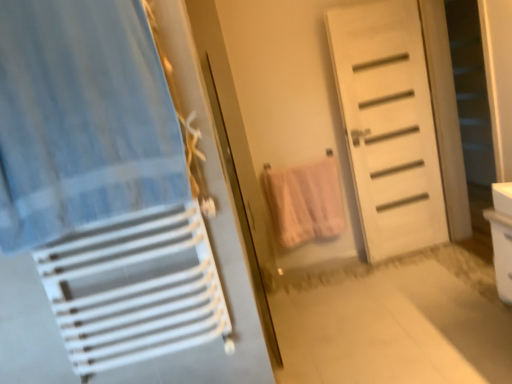
The height and width of the screenshot is (384, 512). What do you see at coordinates (388, 125) in the screenshot?
I see `white matte door at center` at bounding box center [388, 125].

This screenshot has width=512, height=384. Find the location of `blue striped fabric at left`. blue striped fabric at left is located at coordinates (82, 119).

The height and width of the screenshot is (384, 512). What are the coordinates of `pink cotton towel at center` in the screenshot? It's located at (305, 201).

Where is `white matte screen door at right`? This screenshot has height=384, width=512. white matte screen door at right is located at coordinates point(471,90).

I want to click on white plastic drawer at right, so click(x=501, y=251).

This screenshot has height=384, width=512. Identify the location of white matte door at center. (388, 125).

At what (x,y) coordinates should I click in order to perform the action: click on door to the right of blue striped fabric at left. Please return your answer as a coordinate pair (x, y). Looking at the image, I should click on (388, 125).

Based on their sizes in the image, would you say white matte door at center is bigger or smaller than blue striped fabric at left?

In the image, white matte door at center appears to be larger than blue striped fabric at left.

Is white matte door at center aimed at blue striped fabric at left?

No.

Based on the photo, is white matte door at center far away from blue striped fabric at left?

white matte door at center is far away from blue striped fabric at left.

From the image's perspective, is pink cotton towel at center positioned above or below white plastic drawer at right?

Clearly, from the image's perspective, pink cotton towel at center is above white plastic drawer at right.

From a real-world perspective, is pink cotton towel at center positioned over white plastic drawer at right based on gravity?

Yes, from a real-world perspective, pink cotton towel at center is over white plastic drawer at right

Can you confirm if white matte screen door at right is wider than white plastic drawer at right?

No, white matte screen door at right is not wider than white plastic drawer at right.

Is white plastic drawer at right at the back of white matte screen door at right?

white matte screen door at right does not have its back to white plastic drawer at right.

From the image's perspective, is white matte screen door at right located beneath white plastic drawer at right?

No, from the image's perspective, white matte screen door at right is not beneath white plastic drawer at right.

Would you say white matte screen door at right is a long distance from white plastic drawer at right?

Yes, white matte screen door at right and white plastic drawer at right are quite far apart.

From the image's perspective, is blue striped fabric at left under white matte door at center?

Indeed, from the image's perspective, blue striped fabric at left is shown beneath white matte door at center.

In the scene shown: Would you say blue striped fabric at left is inside or outside white matte door at center?

blue striped fabric at left is spatially situated outside white matte door at center.

Is blue striped fabric at left thinner than white matte door at center?

Incorrect, the width of blue striped fabric at left is not less than that of white matte door at center.

Does point (397, 141) come in front of point (494, 261)?

No, (397, 141) is behind (494, 261).

Is white matte door at center shorter than white plastic drawer at right?

No.

Looking at this image, from a real-world perspective, who is located lower, white matte door at center or white plastic drawer at right?

In real-world perspective, white plastic drawer at right is lower.

Does white matte door at center come behind white plastic drawer at right?

Yes, it is.

From the image's perspective, between white matte door at center and pink cotton towel at center, which one is located above?

white matte door at center, from the image's perspective.

Is white matte door at center in front of pink cotton towel at center?

Yes, white matte door at center is closer to the camera.

Can you tell me how much white matte door at center and pink cotton towel at center differ in facing direction?

The facing directions of white matte door at center and pink cotton towel at center are 0.866 degrees apart.

Is white plastic drawer at right positioned beyond the bounds of white matte screen door at right?

white plastic drawer at right is positioned outside white matte screen door at right.

What's the angular difference between white plastic drawer at right and white matte screen door at right's facing directions?

117 degrees separate the facing orientations of white plastic drawer at right and white matte screen door at right.

Is white plastic drawer at right looking in the opposite direction of white matte screen door at right?

No, white plastic drawer at right is not facing away from white matte screen door at right.

From a real-world perspective, which object rests below the other?

white plastic drawer at right, from a real-world perspective.

Find the location of a particular element. curtain below the white matte door at center (from the image's perspective) is located at coordinates (82, 119).

Locate an element on the screen. The image size is (512, 384). drawer in front of the pink cotton towel at center is located at coordinates (501, 251).

From the image, which object appears to be farther from white plastic drawer at right, white matte door at center or pink cotton towel at center?

Based on the image, pink cotton towel at center appears to be further to white plastic drawer at right.

When comparing their distances from pink cotton towel at center, does white matte door at center or blue striped fabric at left seem closer?

The object closer to pink cotton towel at center is white matte door at center.

From the image, which object appears to be farther from blue striped fabric at left, white matte door at center or white matte screen door at right?

Among the two, white matte screen door at right is located further to blue striped fabric at left.

Based on their spatial positions, is white matte screen door at right or blue striped fabric at left further from white plastic drawer at right?

Among the two, white matte screen door at right is located further to white plastic drawer at right.

Which object lies nearer to the anchor point blue striped fabric at left, white plastic drawer at right or white matte door at center?

Based on the image, white plastic drawer at right appears to be nearer to blue striped fabric at left.

When comparing their distances from pink cotton towel at center, does white plastic drawer at right or white matte door at center seem further?

The object further to pink cotton towel at center is white plastic drawer at right.

When comparing their distances from white matte screen door at right, does blue striped fabric at left or white plastic drawer at right seem closer?

white plastic drawer at right is positioned closer to the anchor white matte screen door at right.

Based on their spatial positions, is white plastic drawer at right or pink cotton towel at center closer to white matte screen door at right?

pink cotton towel at center is closer to white matte screen door at right.

I want to click on door between blue striped fabric at left and white matte screen door at right from front to back, so click(388, 125).

I want to click on drawer between blue striped fabric at left and pink cotton towel at center from front to back, so click(501, 251).

The width and height of the screenshot is (512, 384). In order to click on door between blue striped fabric at left and pink cotton towel at center along the z-axis in this screenshot , I will do `click(388, 125)`.

In order to click on drawer between pink cotton towel at center and white matte screen door at right in this screenshot , I will do `click(501, 251)`.